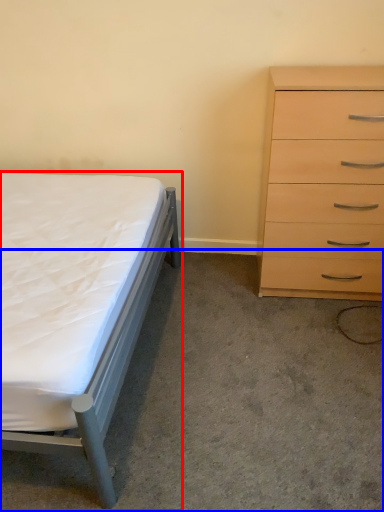
Question: Which of the following is the closest to the observer, bed (highlighted by a red box) or concrete (highlighted by a blue box)?

Choices:
 (A) bed
 (B) concrete

Answer: (A)